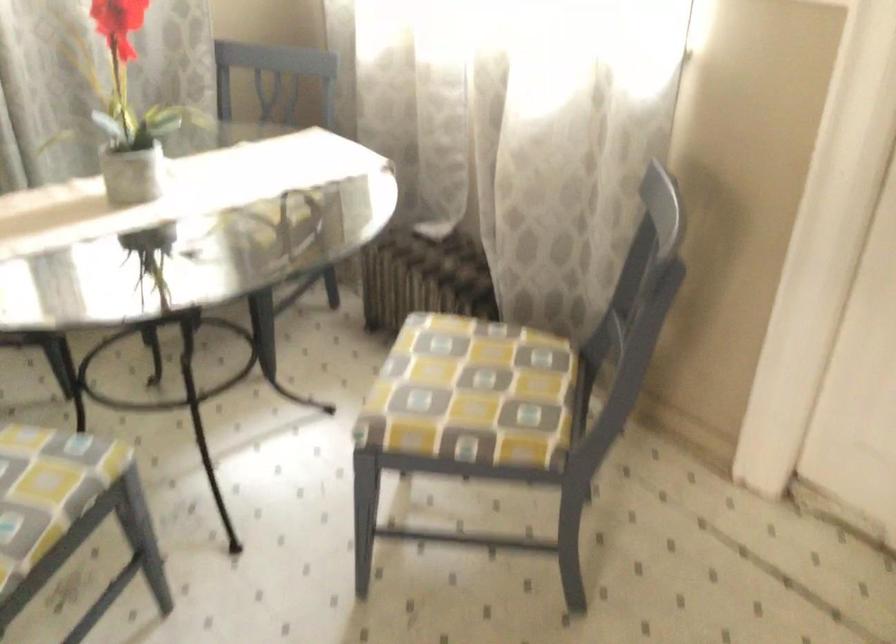
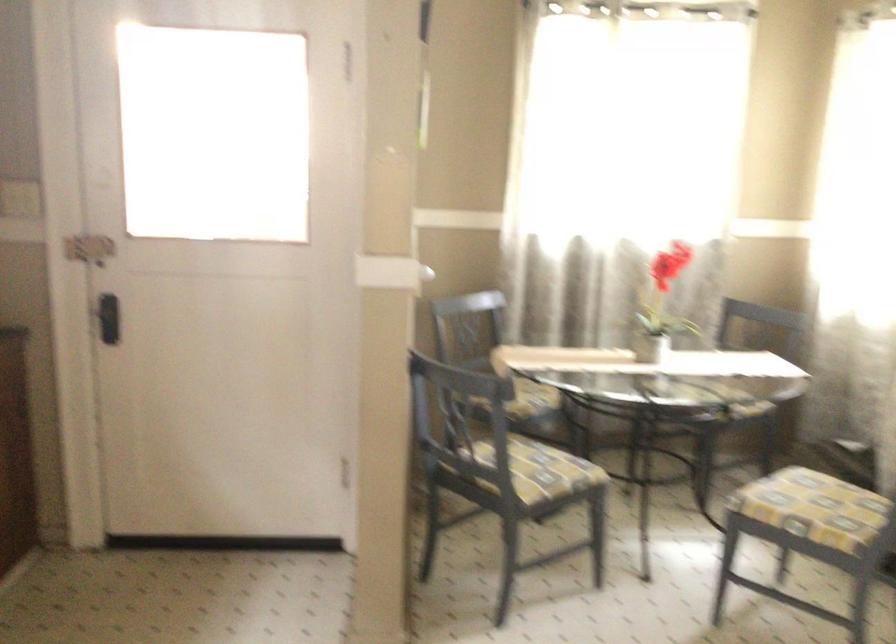
Find the pixel in the second image that matches (x=481, y=305) in the first image.

(833, 460)